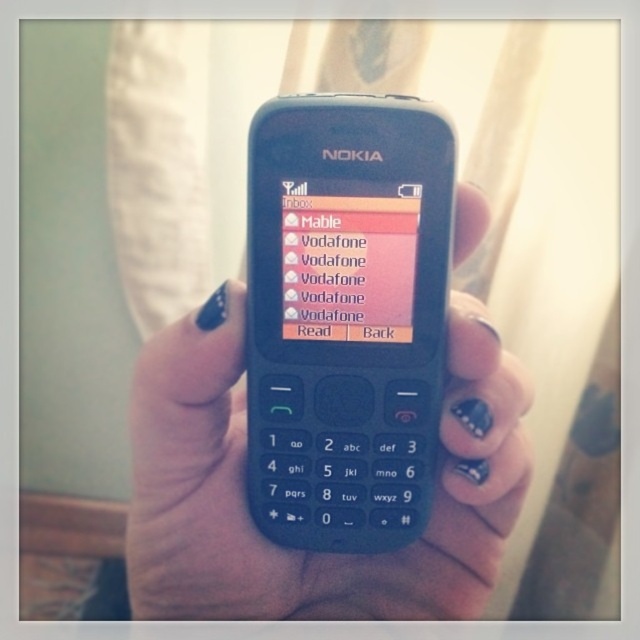
You are trying to read a text message on your phone. The matte plastic nokia phone at center and the pink glossy text message at center are both in your field of view. Which object is positioned to the right?

The pink glossy text message at center is positioned to the right of the matte plastic nokia phone at center.